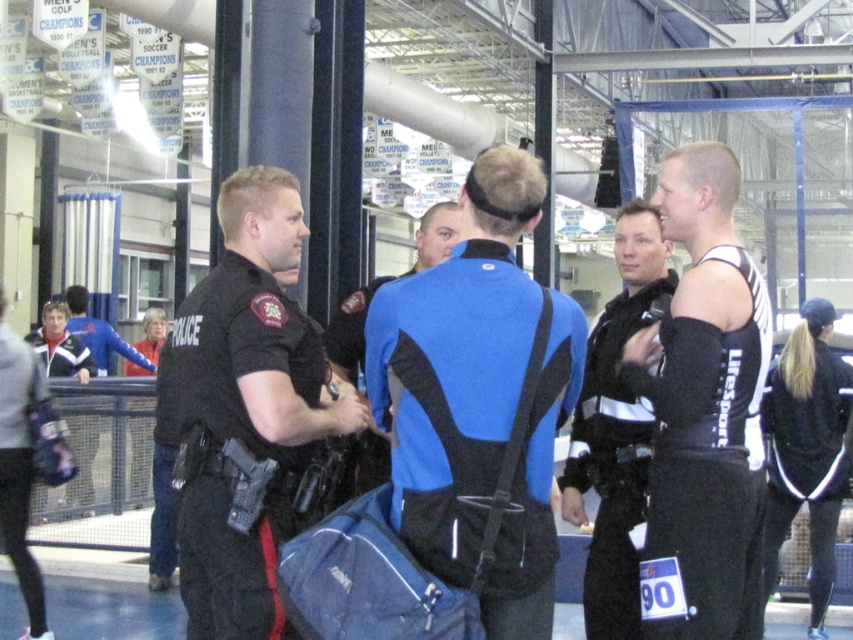
Measure the distance between black matte uniform at center and camera.

The distance of black matte uniform at center from camera is 3.41 meters.

Who is more forward, (637, 577) or (846, 378)?

Positioned in front is point (637, 577).

The height and width of the screenshot is (640, 853). Find the location of `black matte uniform at center`. black matte uniform at center is located at coordinates (616, 428).

Consider the image. Between black/white athletic top at right and black matte uniform at center, which one has more height?

With more height is black/white athletic top at right.

Looking at this image, who is higher up, black/white athletic top at right or black matte uniform at center?

black/white athletic top at right is higher up.

Between point (755, 332) and point (618, 424), which one is positioned behind?

Positioned behind is point (618, 424).

I want to click on black/white athletic top at right, so click(705, 404).

Does black matte uniform at center come in front of matte black jacket at left?

Yes, black matte uniform at center is closer to the viewer.

Is the position of black matte uniform at center more distant than that of matte black jacket at left?

That is False.

Who is more distant from viewer, (563, 481) or (64, 349)?

Point (64, 349)

The width and height of the screenshot is (853, 640). I want to click on black matte uniform at center, so click(x=616, y=428).